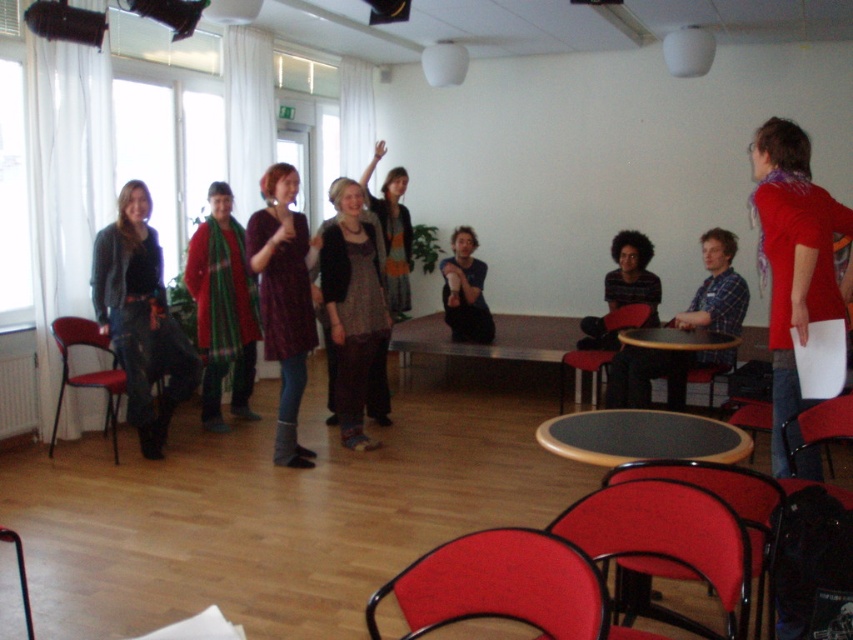
You are organizing a photo shoot and need to arrange two shirts in a display case. The display case has two compartments. The first compartment is designed for larger items, and the second is for smaller ones. Given the red matte shirt at upper right and the striped cotton shirt at center, which shirt should go into which compartment?

The red matte shirt at upper right should be placed in the first compartment for larger items, while the striped cotton shirt at center should go into the second compartment for smaller items, as the red matte shirt at upper right is larger in size compared to the striped cotton shirt at center.

You are organizing a photo shoot and need to ensure that the matte gray sweater at center and the dark blue jeans at center are framed properly. Which item should be placed higher in the frame to maintain their natural positions as seen in the image?

The matte gray sweater at center should be placed higher in the frame because it has a greater height compared to the dark blue jeans at center, maintaining their natural positions as seen in the image.